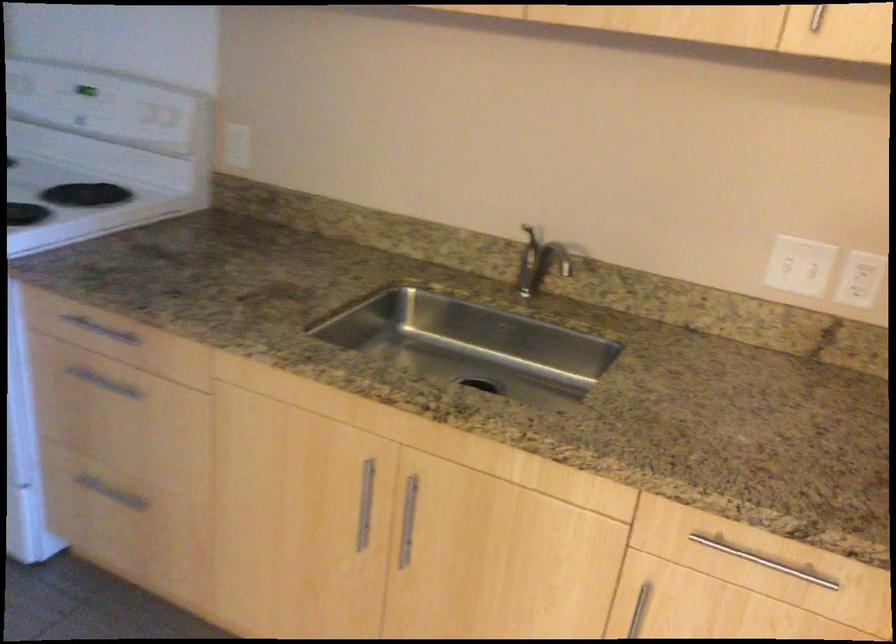
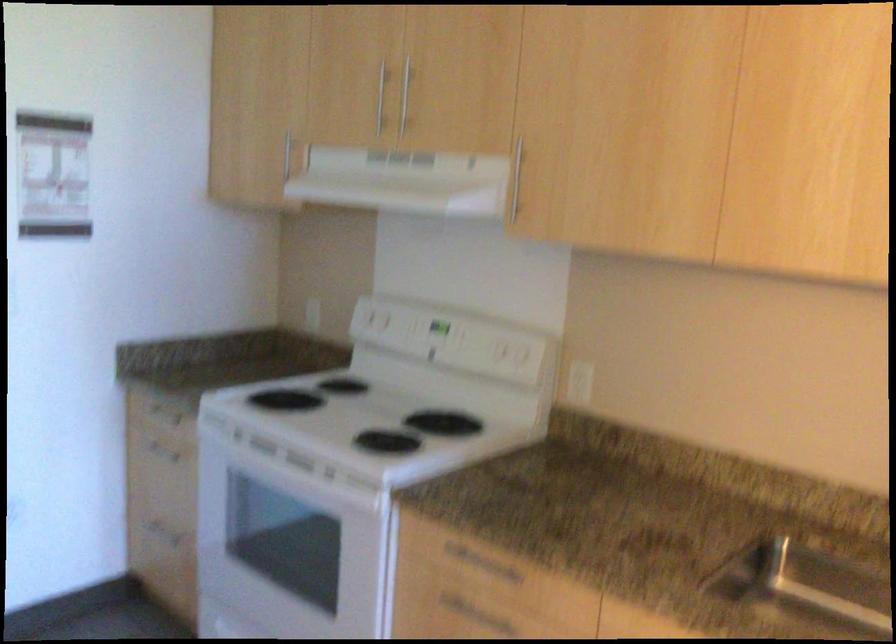
Find the pixel in the second image that matches point 96,377 in the first image.

(466, 609)